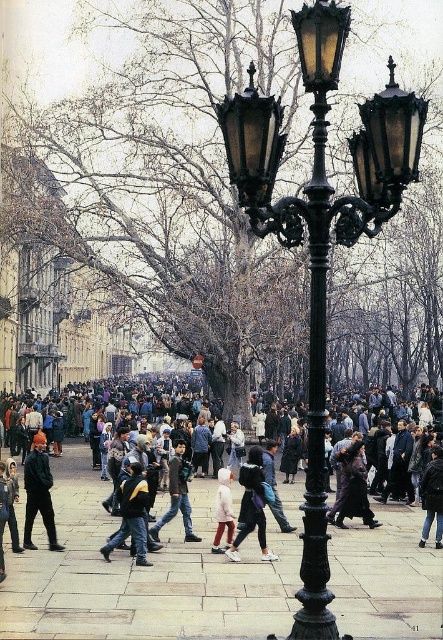
Is point (391, 577) positioned in front of point (245, 147)?

No, (391, 577) is further to viewer.

Between point (400, 560) and point (314, 35), which one is positioned in front?

Point (314, 35) is in front.

Locate an element on the screen. Image resolution: width=443 pixels, height=640 pixels. smooth stone pavement at center is located at coordinates (143, 573).

Between dark blue jacket at center and light pink fabric pants at center, which one appears on the left side from the viewer's perspective?

dark blue jacket at center is more to the left.

Is point (138, 563) positioned behind point (213, 541)?

No, it is in front of (213, 541).

You are a GUI agent. You are given a task and a screenshot of the screen. Output one action in this format:
    pyautogui.click(x=<x>, y=<y>)
    Task: Click on the dark blue jacket at center
    This screenshot has width=443, height=640.
    Given the screenshot: What is the action you would take?
    pyautogui.click(x=132, y=515)

Can you confirm if black wrought iron street light at center is thinner than light pink fabric pants at center?

Incorrect, black wrought iron street light at center's width is not less than light pink fabric pants at center's.

Between point (399, 122) and point (228, 486), which one is positioned in front?

Point (399, 122) is in front.

Locate an element on the screen. The height and width of the screenshot is (640, 443). black wrought iron street light at center is located at coordinates (321, 228).